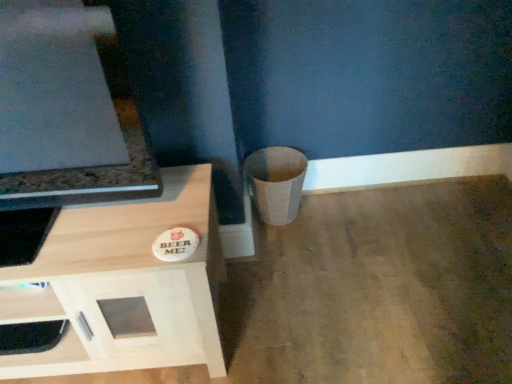
Locate an element on the screen. Image resolution: width=512 pixels, height=384 pixels. vacant region in front of matte beige trash can at lower right is located at coordinates (292, 254).